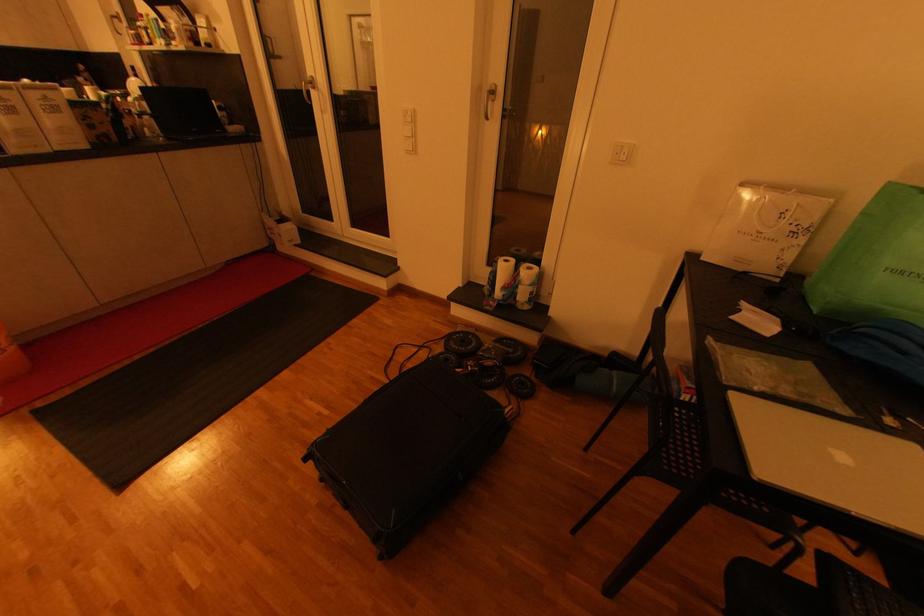
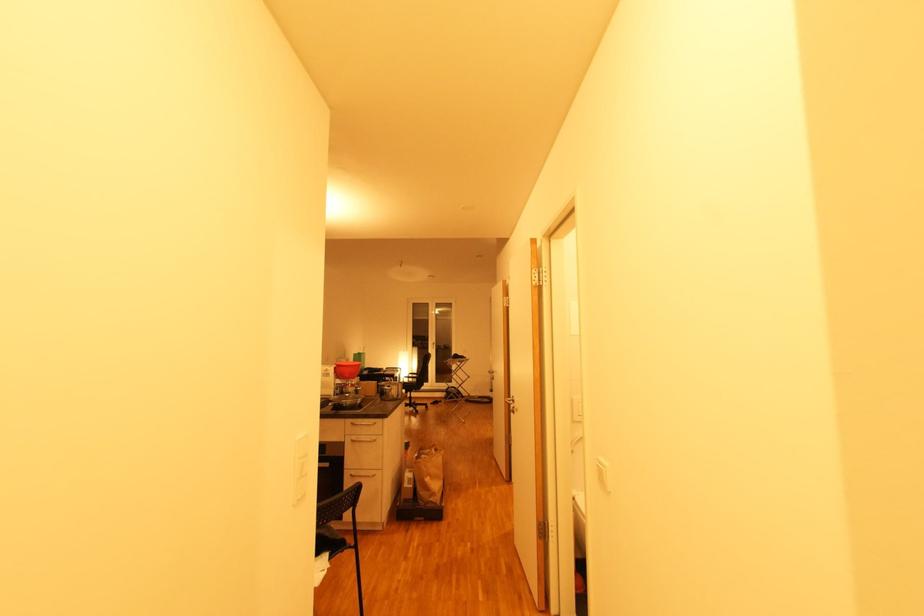
Question: I am providing you with two images of the same scene from different viewpoints. After the viewpoint changes to image2, which objects are now occluded?

Choices:
 (A) white door handle
 (B) metal drawer handle
 (C) silver door handle
 (D) red lever handle

Answer: (A)